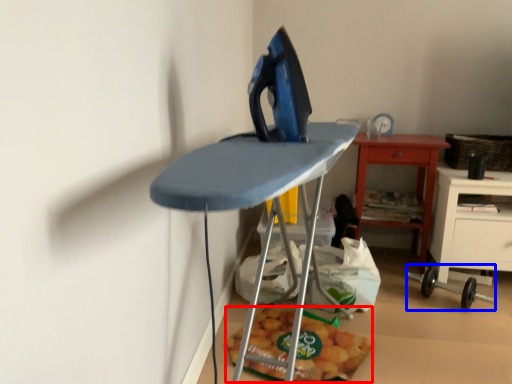
Question: Among these objects, which one is farthest to the camera, food (highlighted by a red box) or equipment (highlighted by a blue box)?

Choices:
 (A) food
 (B) equipment

Answer: (B)